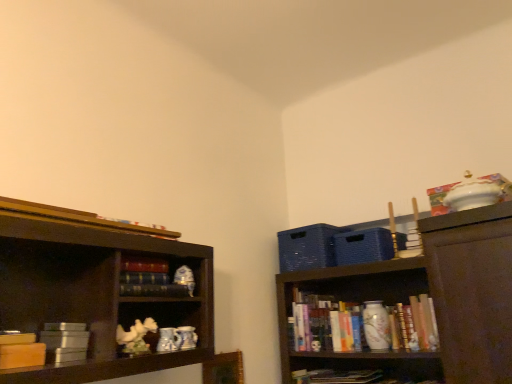
Question: From the image's perspective, is black matte bookshelf at center, which is counted as the 2th book, starting from the right, located above hardcover book at upper left, marked as the third book in a right-to-left arrangement?

Choices:
 (A) yes
 (B) no

Answer: (B)

Question: Is black matte bookshelf at center, placed as the 4th book when sorted from left to right, looking in the opposite direction of hardcover book at upper left, marked as the third book in a right-to-left arrangement?

Choices:
 (A) yes
 (B) no

Answer: (B)

Question: From a real-world perspective, is black matte bookshelf at center, placed as the 4th book when sorted from left to right, positioned over hardcover book at upper left, the first book from the front, based on gravity?

Choices:
 (A) yes
 (B) no

Answer: (B)

Question: Is black matte bookshelf at center, positioned as the second book in top-to-bottom order, taller than hardcover book at upper left, the first book from the front?

Choices:
 (A) yes
 (B) no

Answer: (B)

Question: Is hardcover book at upper left, placed as the fifth book when sorted from bottom to top, surrounded by black matte bookshelf at center, which is counted as the 2th book, starting from the back?

Choices:
 (A) yes
 (B) no

Answer: (B)

Question: Is the depth of black matte bookshelf at center, which is counted as the fourth book, starting from the front, greater than that of hardcover book at upper left, placed as the fifth book when sorted from bottom to top?

Choices:
 (A) yes
 (B) no

Answer: (A)

Question: Is hardcover book at upper left, the first book from the front, looking in the opposite direction of matte yellow book at left, which is the fourth book from back to front?

Choices:
 (A) no
 (B) yes

Answer: (A)

Question: Is hardcover book at upper left, marked as the third book in a right-to-left arrangement, touching matte yellow book at left, the first book in the left-to-right sequence?

Choices:
 (A) yes
 (B) no

Answer: (B)

Question: Is hardcover book at upper left, which is counted as the 3th book, starting from the left, not inside matte yellow book at left, placed as the third book when sorted from bottom to top?

Choices:
 (A) yes
 (B) no

Answer: (A)

Question: From the image's perspective, is hardcover book at upper left, which is counted as the 3th book, starting from the left, located above matte yellow book at left, placed as the third book when sorted from bottom to top?

Choices:
 (A) yes
 (B) no

Answer: (A)

Question: Is hardcover book at upper left, the first book from the front, not near matte yellow book at left, arranged as the fifth book when viewed from the right?

Choices:
 (A) no
 (B) yes

Answer: (A)

Question: Can matte yellow book at left, placed as the second book when sorted from front to back, be found inside hardcover book at upper left, placed as the fifth book when sorted from bottom to top?

Choices:
 (A) yes
 (B) no

Answer: (B)

Question: From a real-world perspective, is black matte bookshelf at center, which is counted as the 2th book, starting from the back, beneath metallic silver book at lower left, arranged as the 2th book when viewed from the left?

Choices:
 (A) yes
 (B) no

Answer: (B)